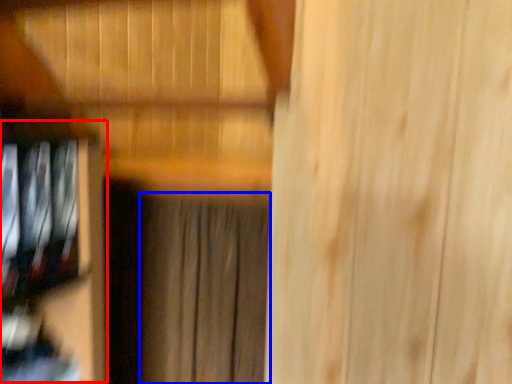
Question: Which of the following is the closest to the observer, shelf (highlighted by a red box) or curtain (highlighted by a blue box)?

Choices:
 (A) shelf
 (B) curtain

Answer: (A)